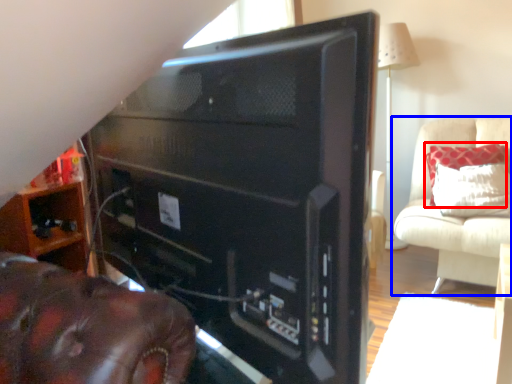
Question: Which of the following is the closest to the observer, pillow (highlighted by a red box) or furniture (highlighted by a blue box)?

Choices:
 (A) pillow
 (B) furniture

Answer: (B)